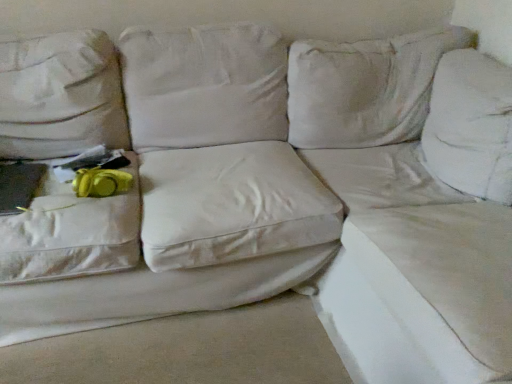
Question: Is white fabric couch at upper right, acting as the first sheet starting from the right, wider or thinner than white fabric sheet at lower right, which is counted as the first sheet, starting from the left?

Choices:
 (A) thin
 (B) wide

Answer: (A)

Question: Is white fabric couch at upper right, acting as the first sheet starting from the right, in front of or behind white fabric sheet at lower right, which is the second sheet from right to left, in the image?

Choices:
 (A) behind
 (B) front

Answer: (B)

Question: Estimate the real-world distances between objects in this image. Which object is closer to the white fabric couch at upper right, acting as the first sheet starting from the right?

Choices:
 (A) white fabric sheet at lower right, which is the second sheet from right to left
 (B) yellow fabric at left

Answer: (A)

Question: Estimate the real-world distances between objects in this image. Which object is farther from the white fabric couch at upper right, acting as the first sheet starting from the right?

Choices:
 (A) white fabric sheet at lower right, which is the second sheet from right to left
 (B) yellow fabric at left

Answer: (B)